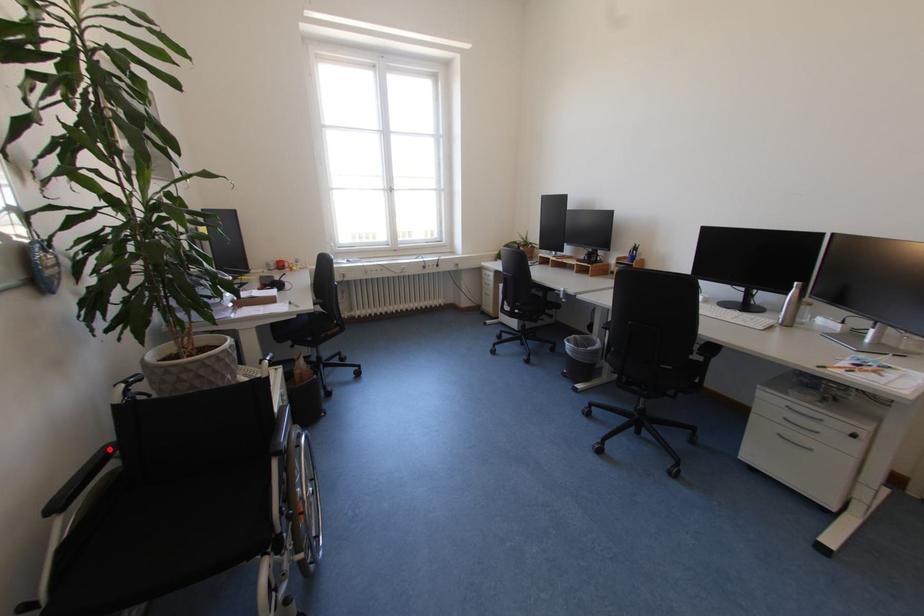
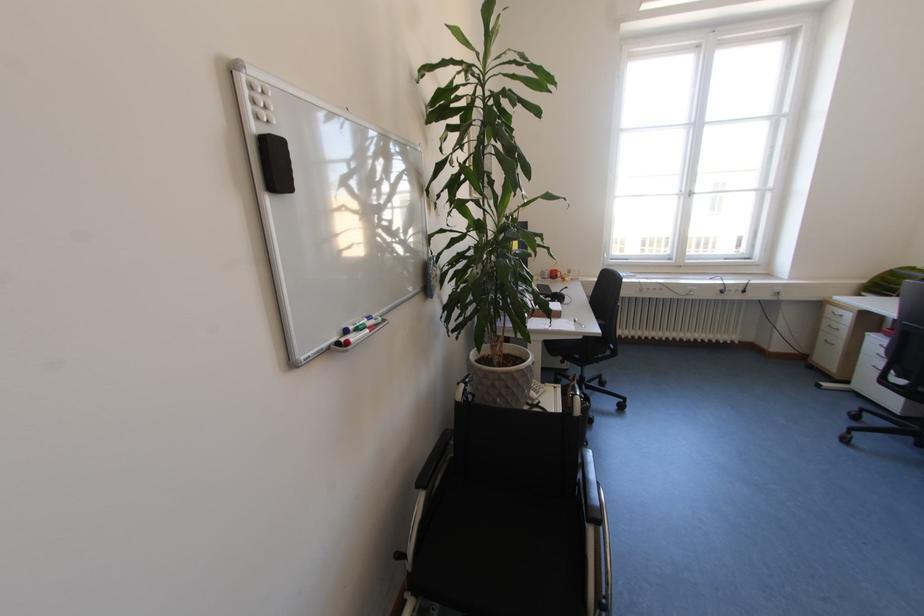
Question: I am providing you with two images of the same scene from different viewpoints. In image1, a red point is highlighted. Considering the same 3D point in image2, which of the following is correct?

Choices:
 (A) It is closer
 (B) It is farther

Answer: (B)